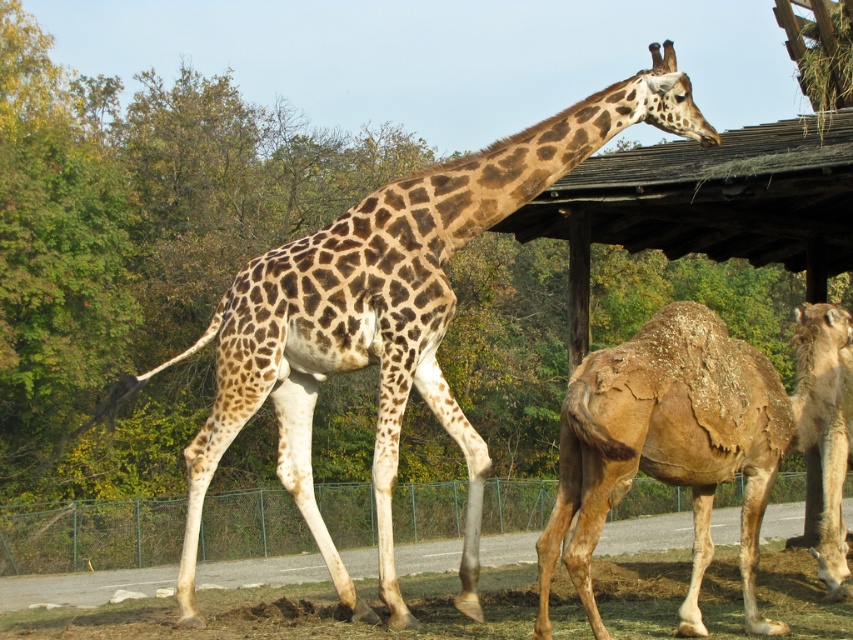
Who is more forward, (257, 362) or (752, 397)?

Positioned in front is point (752, 397).

How distant is spotted fur giraffe at center from brown textured camel at right?

A distance of 3.22 meters exists between spotted fur giraffe at center and brown textured camel at right.

Identify the location of spotted fur giraffe at center. This screenshot has width=853, height=640. (387, 317).

Does brown textured camel at right appear under metallic wire fence at lower center?

No, brown textured camel at right is not below metallic wire fence at lower center.

Does brown textured camel at right have a lesser height compared to metallic wire fence at lower center?

Yes, brown textured camel at right is shorter than metallic wire fence at lower center.

This screenshot has height=640, width=853. Describe the element at coordinates (686, 436) in the screenshot. I see `brown textured camel at right` at that location.

At what (x,y) coordinates should I click in order to perform the action: click on brown textured camel at right. Please return your answer as a coordinate pair (x, y). The width and height of the screenshot is (853, 640). Looking at the image, I should click on (686, 436).

Which is behind, point (288, 467) or point (526, 492)?

Point (526, 492)

Is spotted fur giraffe at center positioned at the back of metallic wire fence at lower center?

Yes.

Measure the distance between spotted fur giraffe at center and camera.

They are 7.16 meters apart.

The image size is (853, 640). Find the location of `spotted fur giraffe at center`. spotted fur giraffe at center is located at coordinates (387, 317).